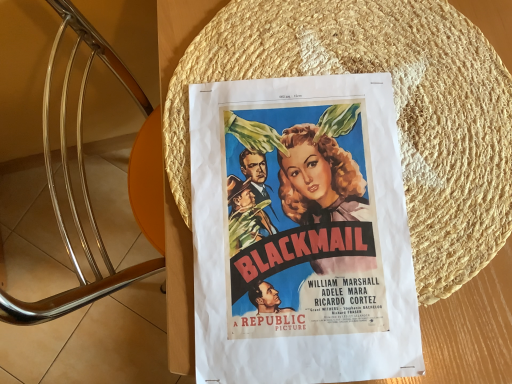
Where is `vacant space underneath woven straw hat at center (from a real-world perspective)`? vacant space underneath woven straw hat at center (from a real-world perspective) is located at coordinates (387, 122).